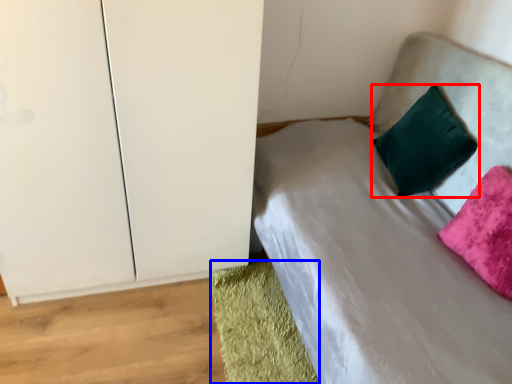
Question: Which point is further to the camera, pillow (highlighted by a red box) or material (highlighted by a blue box)?

Choices:
 (A) pillow
 (B) material

Answer: (A)